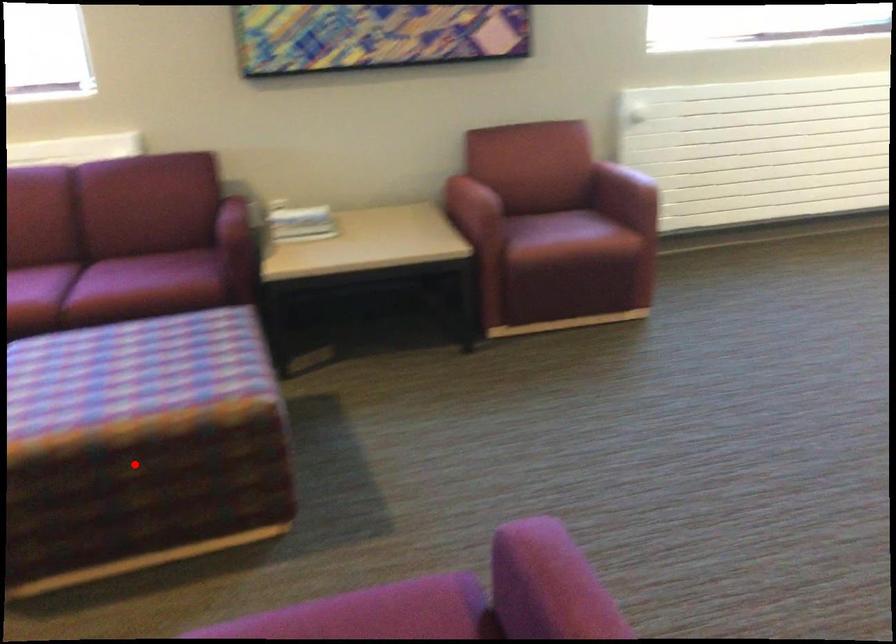
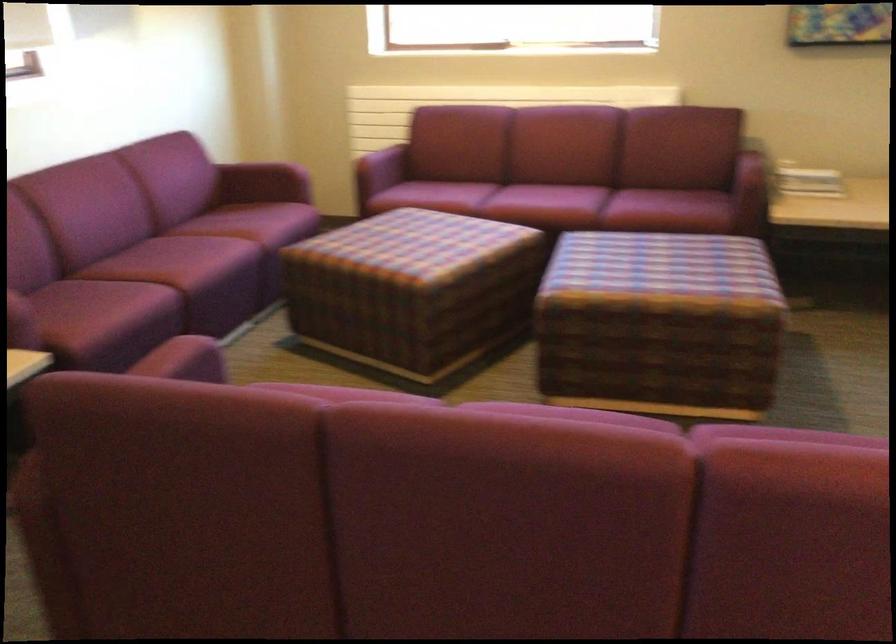
Question: I am providing you with two images of the same scene from different viewpoints. In image1, a red point is highlighted. Considering the same 3D point in image2, which of the following is correct?

Choices:
 (A) It is closer
 (B) It is farther

Answer: (B)